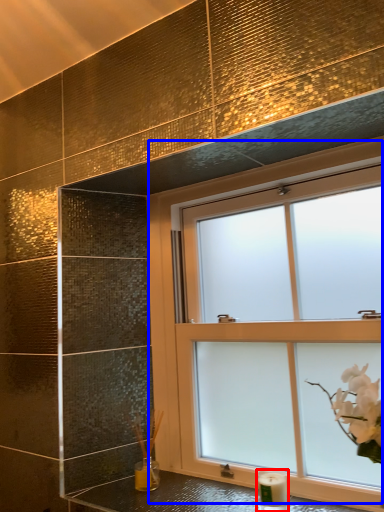
Question: Which object appears farthest to the camera in this image, candle holder (highlighted by a red box) or window (highlighted by a blue box)?

Choices:
 (A) candle holder
 (B) window

Answer: (A)